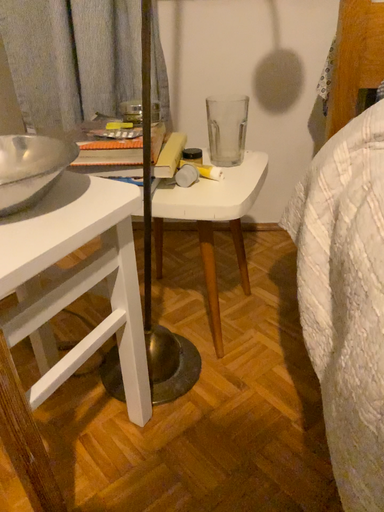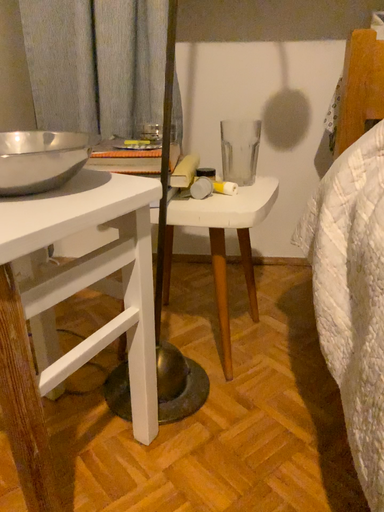
Question: Which way did the camera rotate in the video?

Choices:
 (A) rotated downward
 (B) rotated upward

Answer: (B)